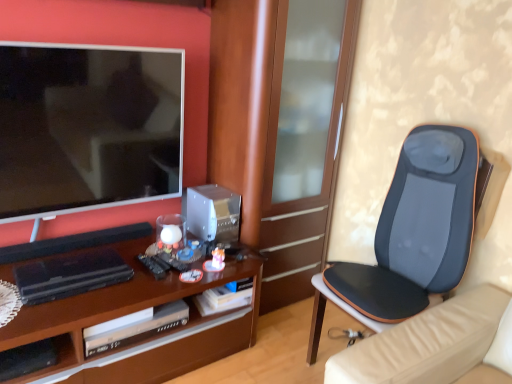
The width and height of the screenshot is (512, 384). In order to click on matte black tv at left in this screenshot , I will do click(87, 127).

What is the approximate width of brown wood cabinet at center?

It is 55.42 centimeters.

Where is `black plastic shelf at lower left`? The height and width of the screenshot is (384, 512). black plastic shelf at lower left is located at coordinates (64, 348).

Is brown wood cabinet at center directly adjacent to black mesh cushion at right?

No, brown wood cabinet at center is not with black mesh cushion at right.

From a real-world perspective, which object stands above the other?

brown wood cabinet at center is physically above.

Considering the relative sizes of brown wood cabinet at center and black mesh cushion at right in the image provided, is brown wood cabinet at center bigger than black mesh cushion at right?

Yes.

Is point (342, 29) farther from camera compared to point (415, 229)?

Yes, it is behind point (415, 229).

Is brown wood desk at center facing towards brown wood cabinet at center?

No, brown wood desk at center is not oriented towards brown wood cabinet at center.

This screenshot has width=512, height=384. I want to click on desk to the left of brown wood cabinet at center, so click(x=124, y=313).

From the picture: What's the angular difference between brown wood desk at center and brown wood cabinet at center's facing directions?

1.06e-05 degrees.

How far apart are brown wood desk at center and brown wood cabinet at center?

brown wood desk at center and brown wood cabinet at center are 25.75 inches apart from each other.

Is matte black tv at left not within brown wood cabinet at center?

Indeed, matte black tv at left is completely outside brown wood cabinet at center.

Does matte black tv at left appear on the right side of brown wood cabinet at center?

No.

How much distance is there between matte black tv at left and brown wood cabinet at center?

matte black tv at left is 23.07 inches away from brown wood cabinet at center.

Is matte black tv at left in front of or behind brown wood cabinet at center in the image?

matte black tv at left is positioned closer to the viewer than brown wood cabinet at center.

From the picture: Does matte black tv at left turn towards brown wood desk at center?

No, matte black tv at left is not aimed at brown wood desk at center.

Considering the sizes of matte black tv at left and brown wood desk at center in the image, is matte black tv at left wider or thinner than brown wood desk at center?

In the image, matte black tv at left appears to be more narrow than brown wood desk at center.

From a real-world perspective, which is physically below, matte black tv at left or brown wood desk at center?

brown wood desk at center is physically lower.

Which is more to the right, black mesh cushion at right or black plastic shelf at lower left?

black mesh cushion at right is more to the right.

Who is smaller, black mesh cushion at right or black plastic shelf at lower left?

black plastic shelf at lower left is smaller.

Does point (400, 197) come behind point (69, 351)?

Yes, point (400, 197) is behind point (69, 351).

Is brown wood desk at center taller or shorter than matte black tv at left?

brown wood desk at center is shorter than matte black tv at left.

Between brown wood desk at center and matte black tv at left, which one has larger size?

brown wood desk at center is bigger.

I want to click on television above the brown wood desk at center (from a real-world perspective), so click(87, 127).

From the image's perspective, is brown wood desk at center beneath matte black tv at left?

Indeed, from the image's perspective, brown wood desk at center is shown beneath matte black tv at left.

From the image's perspective, which object appears higher, black mesh cushion at right or brown wood desk at center?

black mesh cushion at right is shown above in the image.

This screenshot has width=512, height=384. What are the coordinates of `desk on the left of black mesh cushion at right` in the screenshot? It's located at (124, 313).

Is brown wood desk at center at the back of black mesh cushion at right?

No, brown wood desk at center is not at the back of black mesh cushion at right.

How much distance is there between black mesh cushion at right and brown wood desk at center?

black mesh cushion at right is 30.54 inches away from brown wood desk at center.

Identify the location of chair on the right of brown wood cabinet at center. (413, 232).

The height and width of the screenshot is (384, 512). What are the coordinates of `cabinetry lying above the brown wood desk at center (from the image's perspective)` in the screenshot? It's located at (276, 134).

When comparing their distances from brown wood desk at center, does black plastic shelf at lower left or matte black tv at left seem closer?

Among the two, black plastic shelf at lower left is located nearer to brown wood desk at center.

Which object lies nearer to the anchor point brown wood cabinet at center, black mesh cushion at right or matte black tv at left?

matte black tv at left lies closer to brown wood cabinet at center than the other object.

Estimate the real-world distances between objects in this image. Which object is closer to brown wood cabinet at center, black mesh cushion at right or black plastic shelf at lower left?

The object closer to brown wood cabinet at center is black mesh cushion at right.

Based on their spatial positions, is black mesh cushion at right or brown wood desk at center further from matte black tv at left?

black mesh cushion at right lies further to matte black tv at left than the other object.

Based on their spatial positions, is brown wood cabinet at center or brown wood desk at center further from black plastic shelf at lower left?

brown wood cabinet at center.

Estimate the real-world distances between objects in this image. Which object is closer to black plastic shelf at lower left, brown wood desk at center or matte black tv at left?

Among the two, brown wood desk at center is located nearer to black plastic shelf at lower left.

When comparing their distances from matte black tv at left, does black mesh cushion at right or brown wood cabinet at center seem further?

black mesh cushion at right is further to matte black tv at left.

Which object lies nearer to the anchor point brown wood cabinet at center, matte black tv at left or black plastic shelf at lower left?

Among the two, matte black tv at left is located nearer to brown wood cabinet at center.

Where is `television between black plastic shelf at lower left and brown wood cabinet at center from left to right`? This screenshot has width=512, height=384. television between black plastic shelf at lower left and brown wood cabinet at center from left to right is located at coordinates (87, 127).

Where is `desk between matte black tv at left and black plastic shelf at lower left from top to bottom`? The height and width of the screenshot is (384, 512). desk between matte black tv at left and black plastic shelf at lower left from top to bottom is located at coordinates (124, 313).

Image resolution: width=512 pixels, height=384 pixels. Find the location of `cabinetry situated between black plastic shelf at lower left and black mesh cushion at right from left to right`. cabinetry situated between black plastic shelf at lower left and black mesh cushion at right from left to right is located at coordinates (276, 134).

What are the coordinates of `desk between black plastic shelf at lower left and brown wood cabinet at center in the horizontal direction` in the screenshot? It's located at (124, 313).